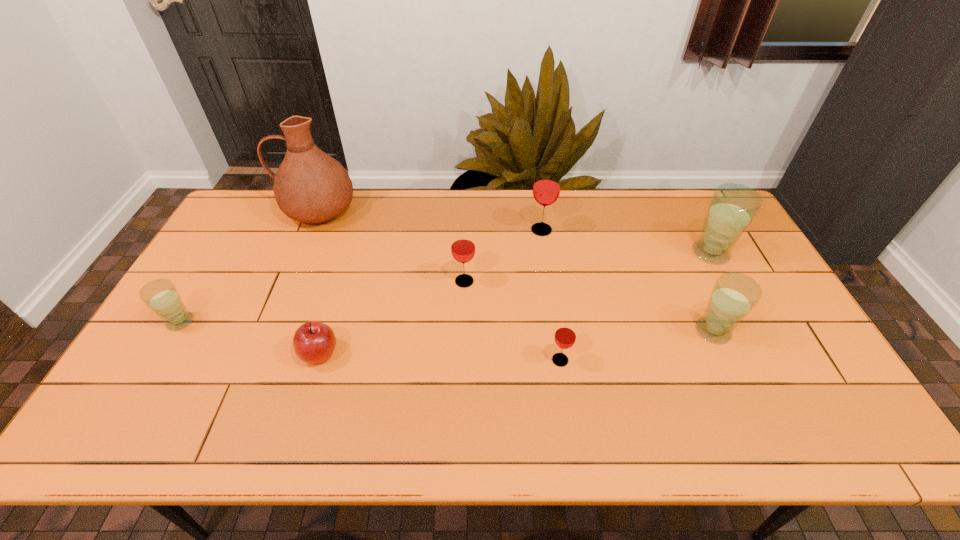
Identify the location of blue glass that is the closest to the biggest blue glass. (733, 296).

Where is `free spot that satisfies the following two spatial constraints: 1. on the side of the tallest object with the handle; 2. on the back side of the second smallest blue glass`? This screenshot has width=960, height=540. free spot that satisfies the following two spatial constraints: 1. on the side of the tallest object with the handle; 2. on the back side of the second smallest blue glass is located at coordinates (268, 331).

Where is `free region that satisfies the following two spatial constraints: 1. on the side of the tallest object with the handle; 2. on the right side of the second glass from left to right`? The image size is (960, 540). free region that satisfies the following two spatial constraints: 1. on the side of the tallest object with the handle; 2. on the right side of the second glass from left to right is located at coordinates (289, 281).

Locate an element on the screen. free space in the image that satisfies the following two spatial constraints: 1. on the side of the pitcher with the handle; 2. on the right side of the biggest blue glass is located at coordinates (300, 253).

The height and width of the screenshot is (540, 960). I want to click on vacant point that satisfies the following two spatial constraints: 1. on the back side of the nearest red glass; 2. on the left side of the second biggest blue glass, so click(x=556, y=331).

Where is `vacant point that satisfies the following two spatial constraints: 1. on the side of the second biggest blue glass with the handle; 2. on the left side of the tallest object`? Image resolution: width=960 pixels, height=540 pixels. vacant point that satisfies the following two spatial constraints: 1. on the side of the second biggest blue glass with the handle; 2. on the left side of the tallest object is located at coordinates (268, 331).